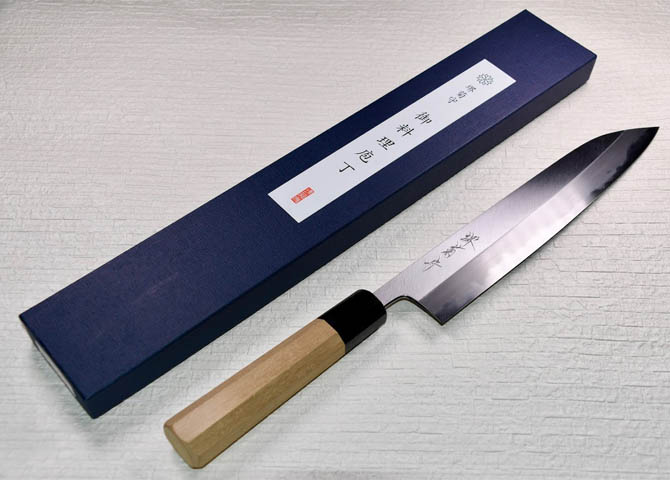
Where is `knife handle`? This screenshot has height=480, width=670. knife handle is located at coordinates (313, 356).